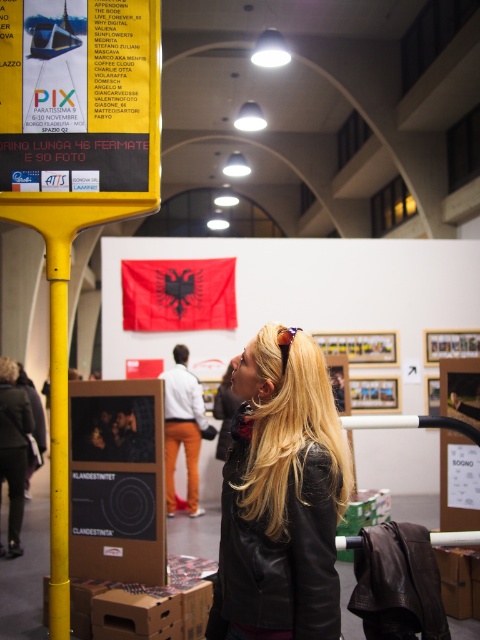
Question: Which point is farther to the camera?

Choices:
 (A) black leather jacket at lower left
 (B) blonde hair at upper left
 (C) yellow matte pole at left

Answer: (B)

Question: Can you confirm if black leather jacket at lower left is positioned above blonde hair at upper left?

Choices:
 (A) no
 (B) yes

Answer: (A)

Question: Which point is closer to the camera?

Choices:
 (A) (6, 360)
 (B) (19, 529)
 (C) (279, 518)

Answer: (C)

Question: Is yellow matte pole at left bigger than blonde hair at upper left?

Choices:
 (A) yes
 (B) no

Answer: (A)

Question: Which object is the farthest from the black leather jacket at lower left?

Choices:
 (A) blonde hair at upper left
 (B) black leather jacket at center

Answer: (B)

Question: Does yellow matte pole at left appear under blonde hair at upper left?

Choices:
 (A) yes
 (B) no

Answer: (B)